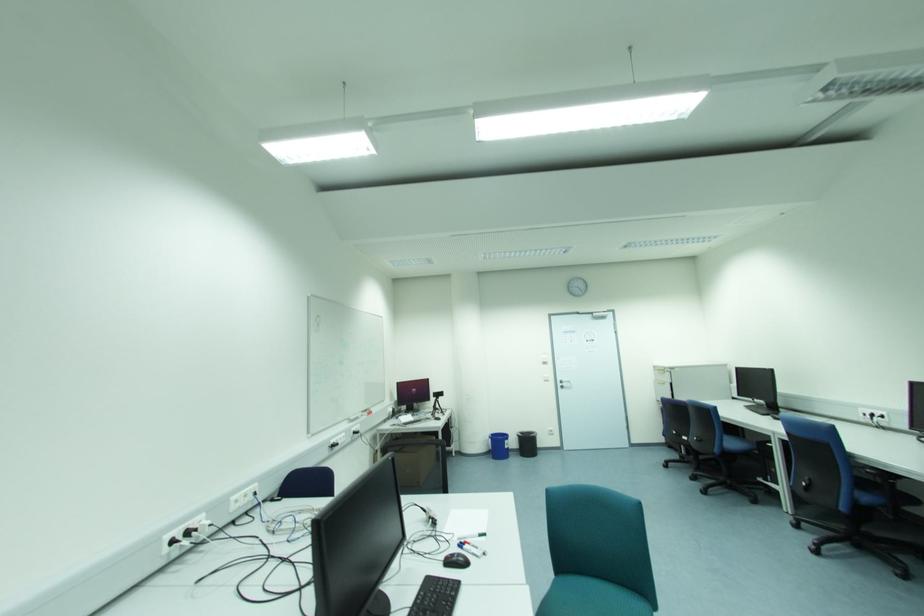
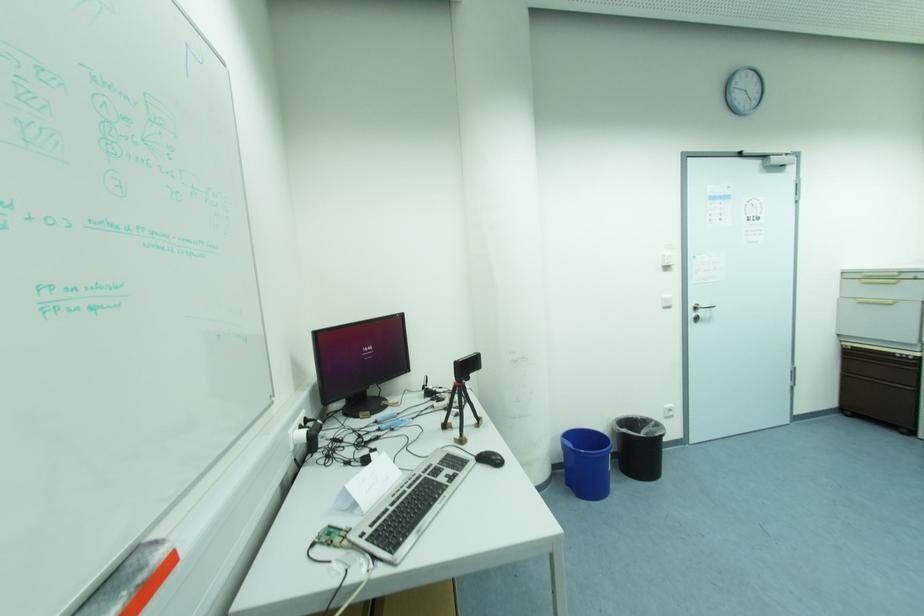
Question: In a continuous first-person perspective shot, in which direction is the camera moving?

Choices:
 (A) Left
 (B) Right
 (C) Forward
 (D) Backward

Answer: (C)